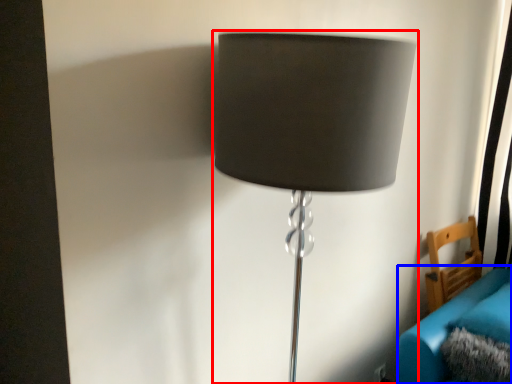
Question: Which object appears closest to the camera in this image, lamp (highlighted by a red box) or couch (highlighted by a blue box)?

Choices:
 (A) lamp
 (B) couch

Answer: (A)